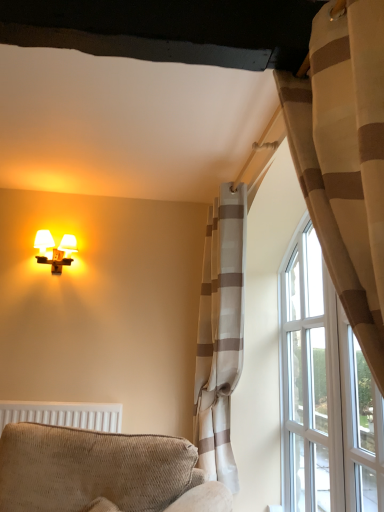
Question: Is textured beige armchair at lower left turned away from light beige striped curtain at upper right, which is the 2th curtain in front-to-back order?

Choices:
 (A) yes
 (B) no

Answer: (A)

Question: From a real-world perspective, does textured beige armchair at lower left sit lower than light beige striped curtain at upper right, which is the 2th curtain in front-to-back order?

Choices:
 (A) no
 (B) yes

Answer: (B)

Question: Is textured beige armchair at lower left located outside light beige striped curtain at upper right, which is the 2th curtain in front-to-back order?

Choices:
 (A) yes
 (B) no

Answer: (A)

Question: Does textured beige armchair at lower left turn towards light beige striped curtain at upper right, which is the 2th curtain in front-to-back order?

Choices:
 (A) no
 (B) yes

Answer: (A)

Question: Does textured beige armchair at lower left have a lesser width compared to light beige striped curtain at upper right, which is the 1th curtain in back-to-front order?

Choices:
 (A) yes
 (B) no

Answer: (B)

Question: From their relative heights in the image, would you say textured beige armchair at lower left is taller or shorter than beige striped curtain at right, arranged as the second curtain when viewed from the back?

Choices:
 (A) short
 (B) tall

Answer: (A)

Question: From a real-world perspective, is textured beige armchair at lower left positioned above or below beige striped curtain at right, arranged as the second curtain when viewed from the back?

Choices:
 (A) below
 (B) above

Answer: (A)

Question: Which is correct: textured beige armchair at lower left is inside beige striped curtain at right, arranged as the first curtain when viewed from the front, or outside of it?

Choices:
 (A) inside
 (B) outside

Answer: (B)

Question: Looking at their shapes, would you say textured beige armchair at lower left is wider or thinner than beige striped curtain at right, arranged as the first curtain when viewed from the front?

Choices:
 (A) thin
 (B) wide

Answer: (B)

Question: Does point (71, 242) appear closer or farther from the camera than point (231, 486)?

Choices:
 (A) closer
 (B) farther

Answer: (B)

Question: In the image, is matte white wall sconce at upper left on the left side or the right side of light beige striped curtain at upper right, which is the 1th curtain in back-to-front order?

Choices:
 (A) left
 (B) right

Answer: (A)

Question: Which is correct: matte white wall sconce at upper left is inside light beige striped curtain at upper right, which is the 2th curtain in front-to-back order, or outside of it?

Choices:
 (A) inside
 (B) outside

Answer: (B)

Question: Considering the positions of matte white wall sconce at upper left and light beige striped curtain at upper right, which is the 1th curtain in back-to-front order, in the image, is matte white wall sconce at upper left taller or shorter than light beige striped curtain at upper right, which is the 1th curtain in back-to-front order,?

Choices:
 (A) short
 (B) tall

Answer: (A)

Question: Is beige striped curtain at right, arranged as the first curtain when viewed from the front, inside the boundaries of textured beige armchair at lower left, or outside?

Choices:
 (A) inside
 (B) outside

Answer: (B)

Question: In terms of size, does beige striped curtain at right, arranged as the second curtain when viewed from the back, appear bigger or smaller than textured beige armchair at lower left?

Choices:
 (A) big
 (B) small

Answer: (B)